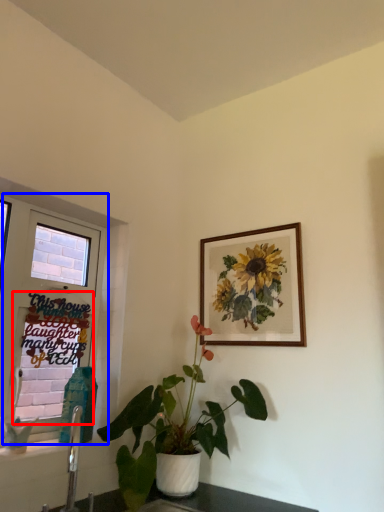
Question: Which object appears closest to the camera in this image, window screen (highlighted by a red box) or window (highlighted by a blue box)?

Choices:
 (A) window screen
 (B) window

Answer: (B)